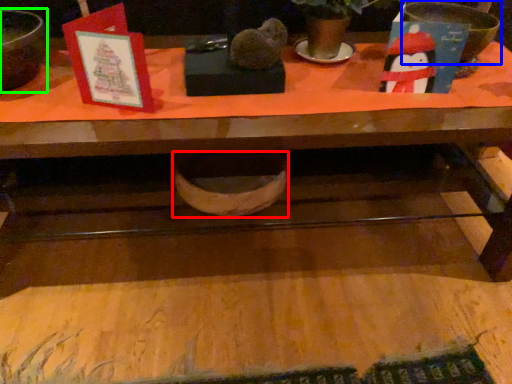
Question: Which is farther away from basin (highlighted by a red box)? basin (highlighted by a blue box) or mixing bowl (highlighted by a green box)?

Choices:
 (A) basin
 (B) mixing bowl

Answer: (A)